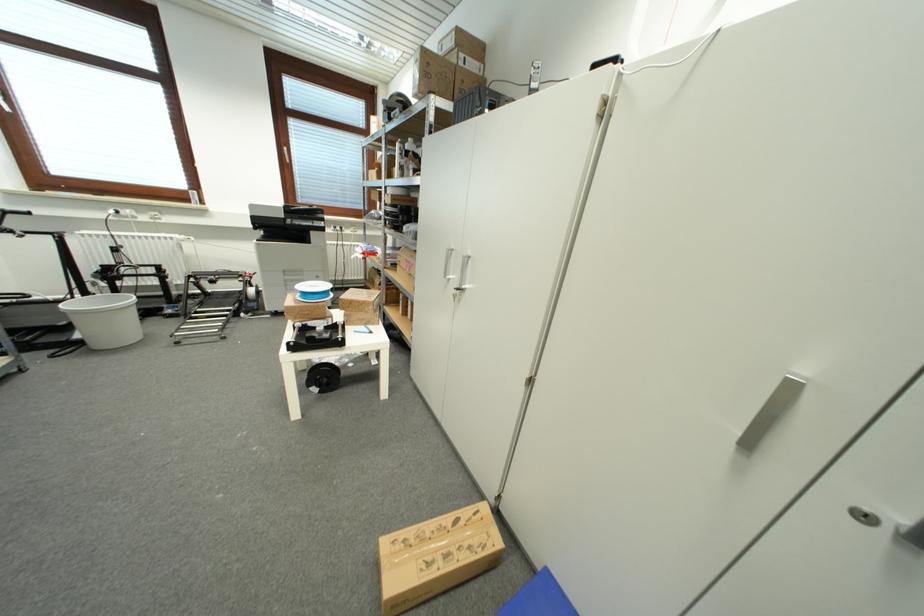
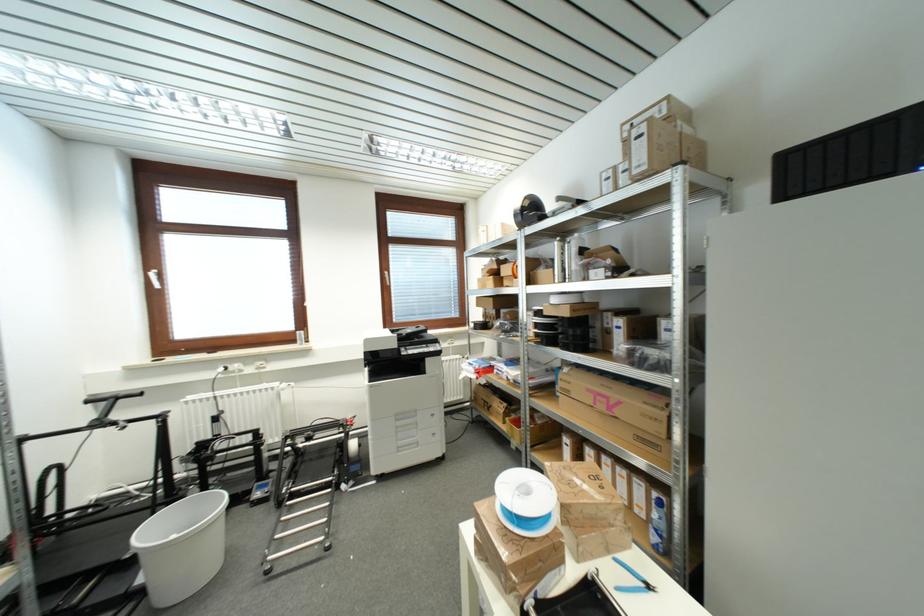
The point at (411,272) is marked in the first image. Where is the corresponding point in the second image?

(605, 408)